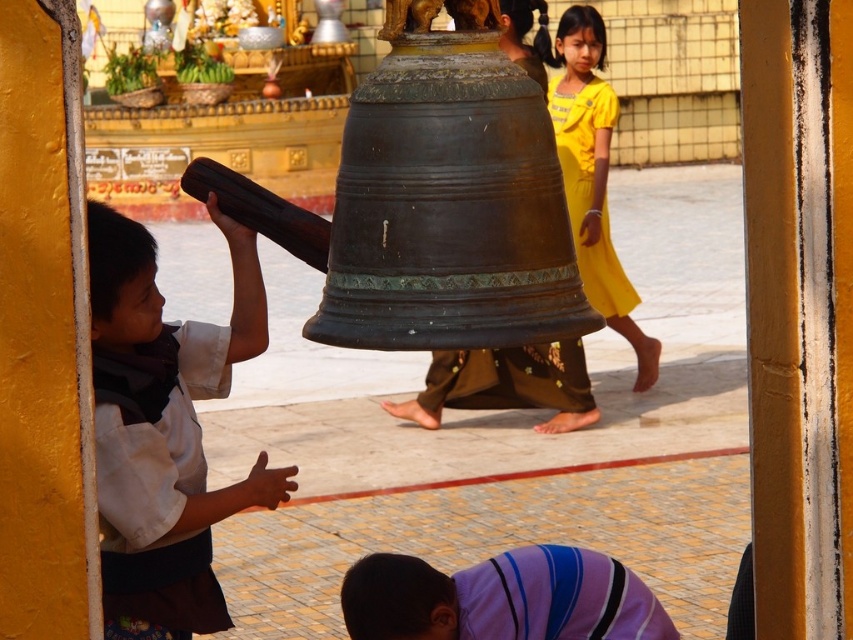
Does point (608, 141) come behind point (498, 356)?

That is True.

Locate an element on the screen. The height and width of the screenshot is (640, 853). yellow matte dress at upper right is located at coordinates (593, 177).

Who is positioned more to the right, white cotton robe at left or purple striped robe at lower center?

purple striped robe at lower center is more to the right.

Looking at this image, can you confirm if white cotton robe at left is positioned to the right of purple striped robe at lower center?

Incorrect, white cotton robe at left is not on the right side of purple striped robe at lower center.

Image resolution: width=853 pixels, height=640 pixels. Find the location of `white cotton robe at left`. white cotton robe at left is located at coordinates (155, 476).

Find the location of a particular element. This screenshot has height=640, width=853. white cotton robe at left is located at coordinates (155, 476).

Does white cotton robe at left appear under bronze bell at center?

Yes.

Is point (103, 554) positioned in front of point (489, 349)?

No, it is not.

You are a GUI agent. You are given a task and a screenshot of the screen. Output one action in this format:
    pyautogui.click(x=<x>, y=<y>)
    Task: Click on the white cotton robe at left
    The height and width of the screenshot is (640, 853).
    Given the screenshot: What is the action you would take?
    pyautogui.click(x=155, y=476)